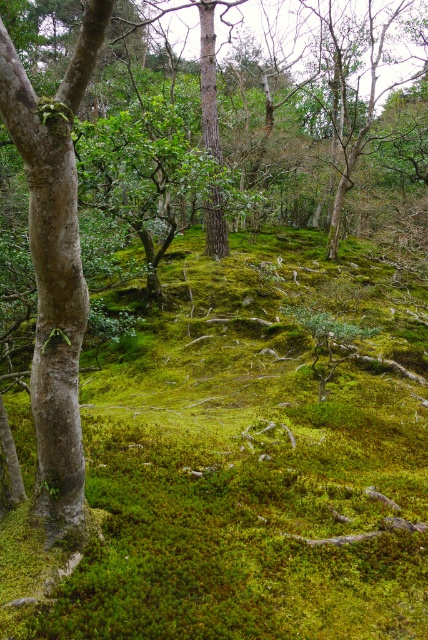
You are a hiker navigating through the forest and want to place markers at the two points labeled point [222,264] and point [226,237]. Based on your current position, which marker should you place first as you move forward?

You should place the marker at point [222,264] first because it is in front of point [226,237] from your current position.

You are standing in the forest scene described. You see a point marked at coordinates [247,467]. According to the scene description, where is this point located?

The point is located on the green mossy ground at center.